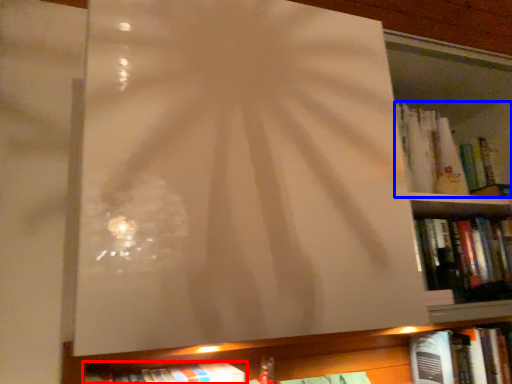
Question: Which object is further to the camera taking this photo, book (highlighted by a red box) or book (highlighted by a blue box)?

Choices:
 (A) book
 (B) book

Answer: (B)